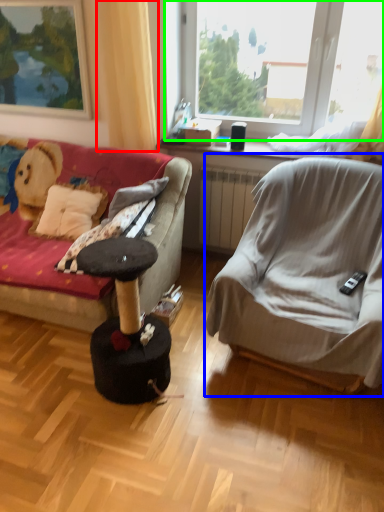
Question: Considering the real-world distances, which object is farthest from curtain (highlighted by a red box)? chair (highlighted by a blue box) or window (highlighted by a green box)?

Choices:
 (A) chair
 (B) window

Answer: (A)